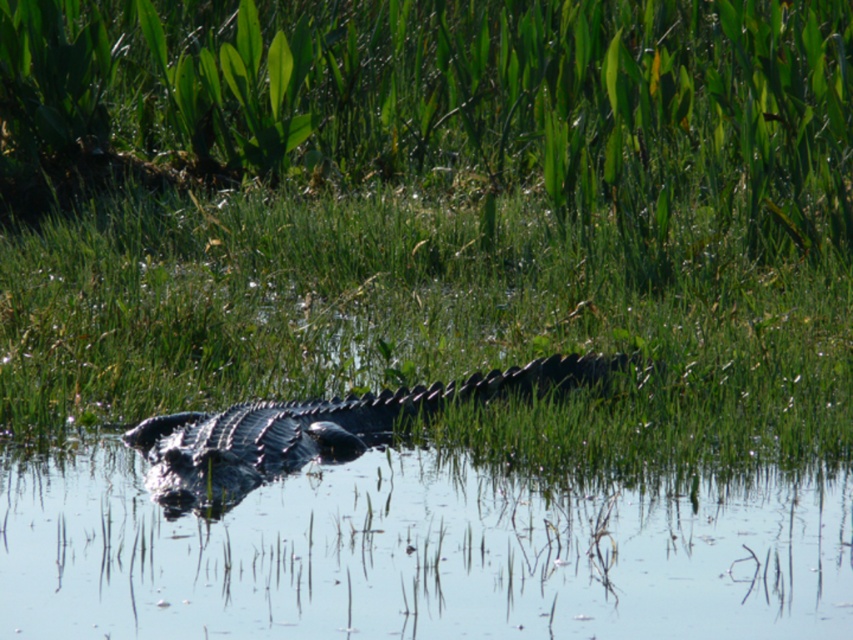
You are a photographer standing in the marshland and want to take a photo of the alligator. You notice two points in the scene labeled as point 1 and point 2. Point 1 is at coordinates point (120, 88) and point 2 is at point (798, 484). Based on their positions, which point is closer to your camera?

Point 1 is closer to the camera because it is further to the camera than point 2.

You are a wildlife photographer aiming to capture the dark green scaly crocodile at center without the clear water at center obstructing the view. Is the crocodile visible through the water?

The clear water at center is in front of the dark green scaly crocodile at center, so yes, the crocodile is visible through the water as the water is positioned in front of it.